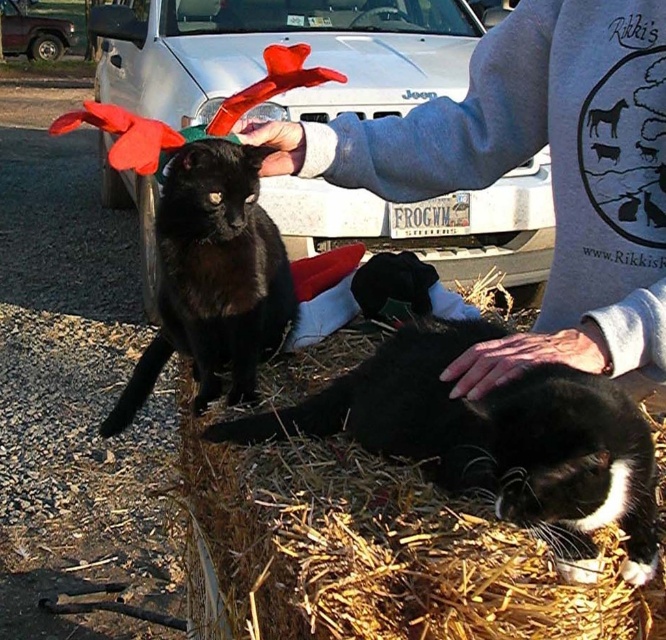
Which is more to the left, gray sweatshirt at upper center or black matte fur cat at upper left?

From the viewer's perspective, black matte fur cat at upper left appears more on the left side.

Where is `gray sweatshirt at upper center`? The image size is (666, 640). gray sweatshirt at upper center is located at coordinates (551, 173).

Which is in front, point (631, 296) or point (400, 413)?

Point (631, 296) is more forward.

Can you confirm if gray sweatshirt at upper center is positioned to the right of black fur cat at lower right?

Correct, you'll find gray sweatshirt at upper center to the right of black fur cat at lower right.

Is point (410, 115) farther from camera compared to point (424, 365)?

Yes.

The width and height of the screenshot is (666, 640). What are the coordinates of `gray sweatshirt at upper center` in the screenshot? It's located at (551, 173).

Which of these two, black fur cat at lower right or black matte fur cat at upper left, stands shorter?

black fur cat at lower right

Can you confirm if black fur cat at lower right is shorter than black matte fur cat at upper left?

Indeed, black fur cat at lower right has a lesser height compared to black matte fur cat at upper left.

Is point (543, 534) positioned after point (246, 292)?

No, it is not.

You are a GUI agent. You are given a task and a screenshot of the screen. Output one action in this format:
    pyautogui.click(x=<x>, y=<y>)
    Task: Click on the black fur cat at lower right
    The image size is (666, 640).
    Given the screenshot: What is the action you would take?
    pyautogui.click(x=494, y=440)